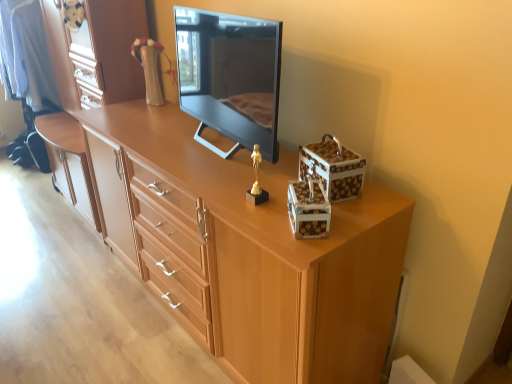
In order to click on free spot above light wood chest of drawers at center (from a real-world perspective) in this screenshot , I will do `click(203, 147)`.